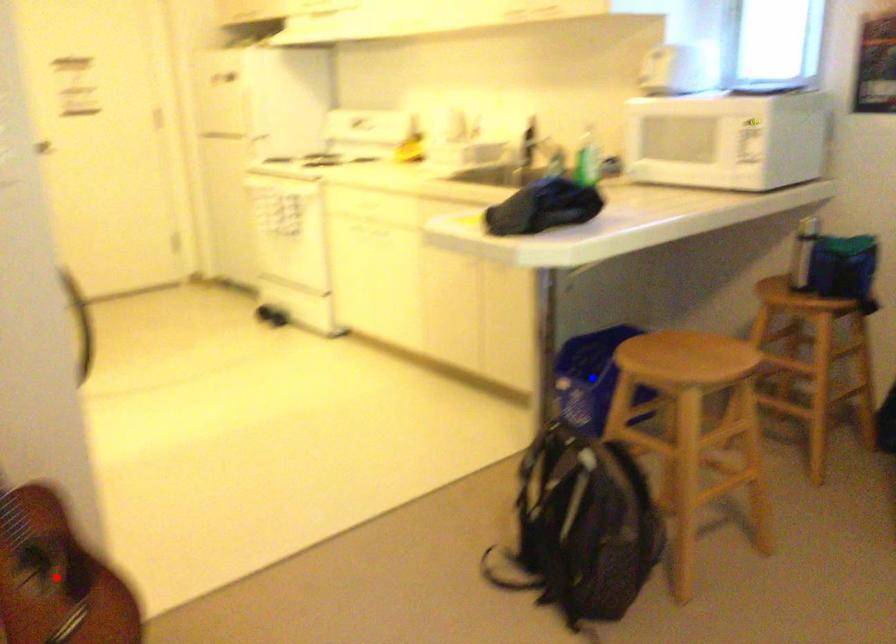
Question: In the image, two points are highlighted. Which point is nearer to the camera? Reply with the corresponding letter.

Choices:
 (A) blue point
 (B) red point

Answer: (B)